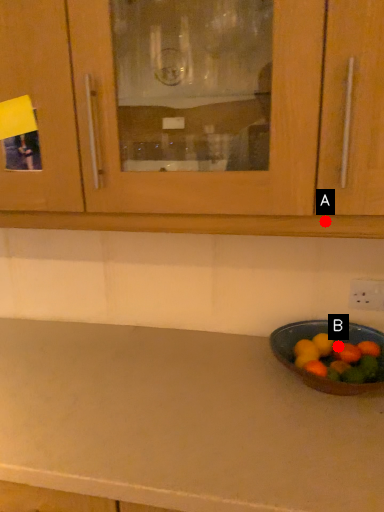
Question: Two points are circled on the image, labeled by A and B beside each circle. Which point is closer to the camera?

Choices:
 (A) A is closer
 (B) B is closer

Answer: (A)